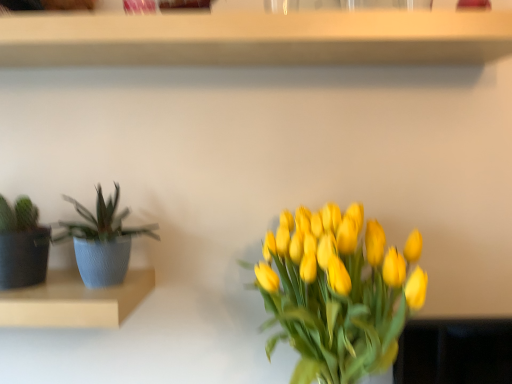
Question: Considering the positions of matte blue pot at left, placed as the 2th shelf when sorted from top to bottom, and wooden shelf at upper center, which ranks as the 1th shelf in top-to-bottom order, in the image, is matte blue pot at left, placed as the 2th shelf when sorted from top to bottom, wider or thinner than wooden shelf at upper center, which ranks as the 1th shelf in top-to-bottom order,?

Choices:
 (A) thin
 (B) wide

Answer: (B)

Question: Considering the positions of matte blue pot at left, which ranks as the 1th shelf in bottom-to-top order, and wooden shelf at upper center, which ranks as the 1th shelf in top-to-bottom order, in the image, is matte blue pot at left, which ranks as the 1th shelf in bottom-to-top order, taller or shorter than wooden shelf at upper center, which ranks as the 1th shelf in top-to-bottom order,?

Choices:
 (A) short
 (B) tall

Answer: (B)

Question: Which object is positioned farthest from the matte blue pot at left, placed as the 2th shelf when sorted from top to bottom?

Choices:
 (A) wooden shelf at upper center, positioned as the second shelf in bottom-to-top order
 (B) blue textured pot at left

Answer: (A)

Question: Estimate the real-world distances between objects in this image. Which object is closer to the blue textured pot at left?

Choices:
 (A) wooden shelf at upper center, which ranks as the 1th shelf in top-to-bottom order
 (B) matte blue pot at left, which ranks as the 1th shelf in bottom-to-top order

Answer: (B)